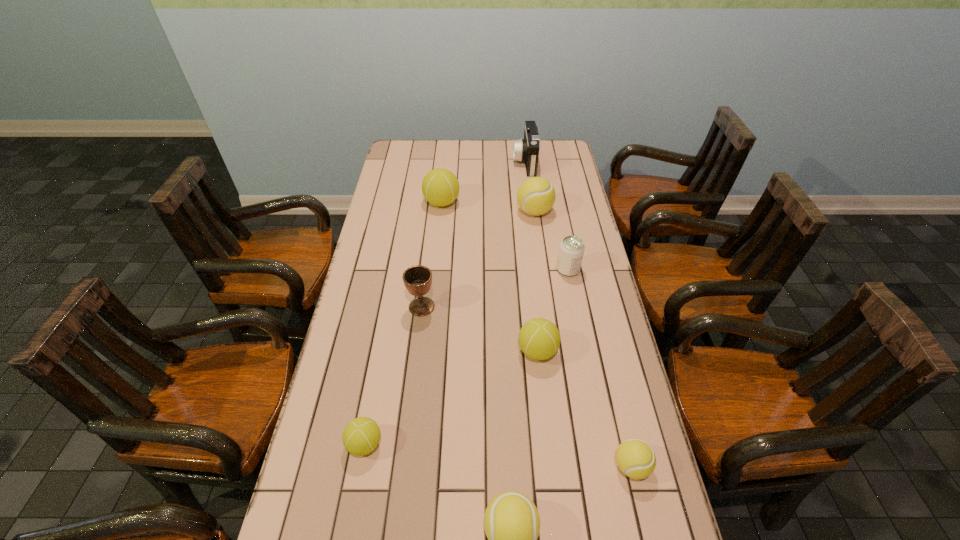
Locate an element on the screen. the rightmost tennis ball is located at coordinates (636, 459).

At what (x,y) coordinates should I click in order to perform the action: click on the second nearest yellow tennis ball. Please return your answer as a coordinate pair (x, y). The width and height of the screenshot is (960, 540). Looking at the image, I should click on (636, 459).

At what (x,y) coordinates should I click in order to perform the action: click on the leftmost tennis ball. Please return your answer as a coordinate pair (x, y). The image size is (960, 540). Looking at the image, I should click on (361, 436).

Where is `the nearest green tennis ball`? the nearest green tennis ball is located at coordinates (361, 436).

This screenshot has height=540, width=960. Identify the location of vacant space located 0.350m on the lens of the camcorder. (437, 162).

Where is `vacant space located 0.370m on the lens of the camcorder`? vacant space located 0.370m on the lens of the camcorder is located at coordinates click(433, 162).

Image resolution: width=960 pixels, height=540 pixels. Identify the location of blank area located on the lens of the camcorder. (426, 162).

Where is `vacant space situated on the back of the farthest yellow tennis ball`? The image size is (960, 540). vacant space situated on the back of the farthest yellow tennis ball is located at coordinates (528, 164).

Locate an element on the screen. The width and height of the screenshot is (960, 540). free point located on the front of the biggest green tennis ball is located at coordinates (434, 283).

This screenshot has width=960, height=540. What are the coordinates of `blank space located on the back of the chalice` in the screenshot? It's located at (431, 225).